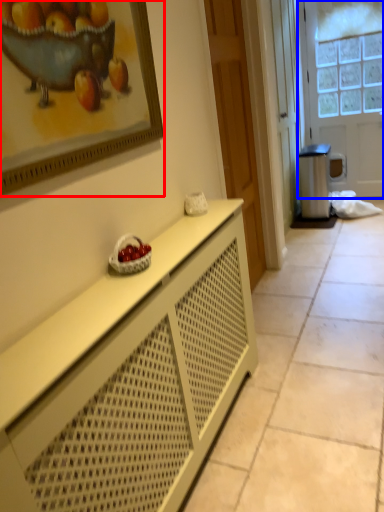
Question: Which of the following is the farthest to the observer, picture frame (highlighted by a red box) or door (highlighted by a blue box)?

Choices:
 (A) picture frame
 (B) door

Answer: (B)